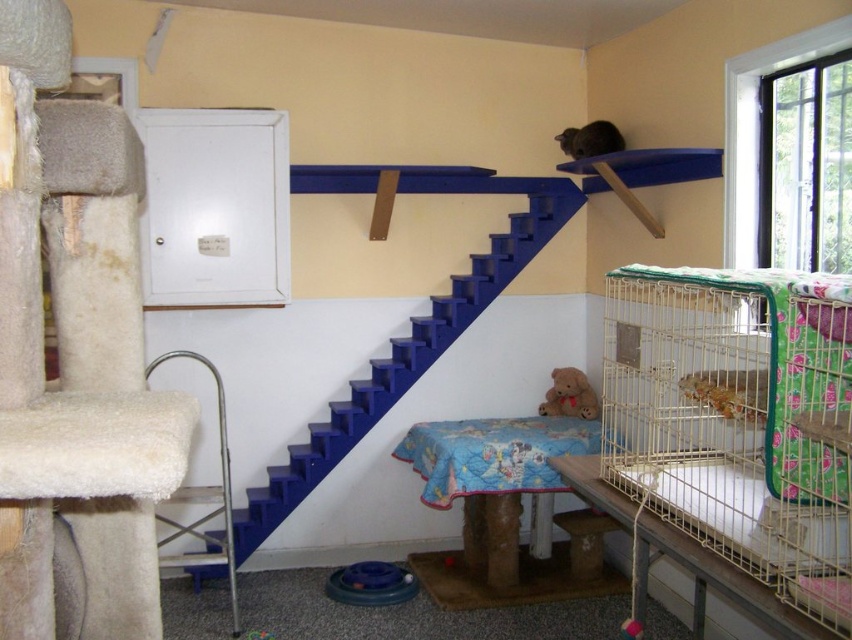
Is white wire birdcage at right smaller than brown furry cat at upper center?

No, white wire birdcage at right is not smaller than brown furry cat at upper center.

From the picture: Is white wire birdcage at right in front of brown furry cat at upper center?

Yes, it is in front of brown furry cat at upper center.

Is point (830, 392) positioned in front of point (593, 125)?

Yes, it is in front of point (593, 125).

Where is `white wire birdcage at right`? white wire birdcage at right is located at coordinates (728, 412).

Based on the photo, who is taller, orange textured lizard at center or brown plush teddy bear at lower center?

Standing taller between the two is brown plush teddy bear at lower center.

Between orange textured lizard at center and brown plush teddy bear at lower center, which one has less height?

Standing shorter between the two is orange textured lizard at center.

This screenshot has height=640, width=852. Describe the element at coordinates (729, 392) in the screenshot. I see `orange textured lizard at center` at that location.

The image size is (852, 640). I want to click on orange textured lizard at center, so click(x=729, y=392).

Who is taller, white wire birdcage at right or orange textured lizard at center?

white wire birdcage at right is taller.

What do you see at coordinates (728, 412) in the screenshot? I see `white wire birdcage at right` at bounding box center [728, 412].

Locate an element on the screen. This screenshot has width=852, height=640. white wire birdcage at right is located at coordinates (728, 412).

Identify the location of white wire birdcage at right. (728, 412).